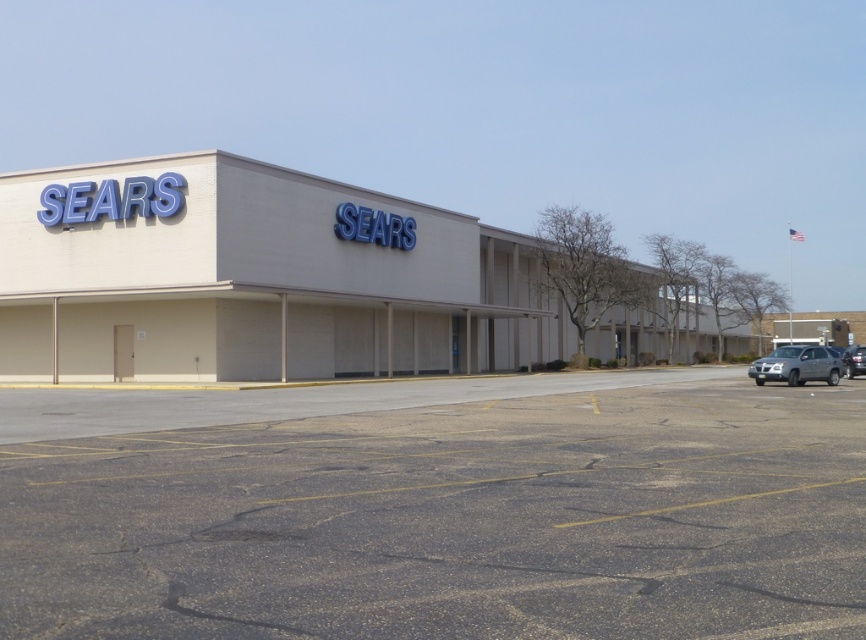
Based on the photo, between gray asphalt parking lot at lower center and beige/smooth building at center, which one is positioned lower?

gray asphalt parking lot at lower center is below.

Does gray asphalt parking lot at lower center appear over beige/smooth building at center?

No.

The image size is (866, 640). I want to click on gray asphalt parking lot at lower center, so click(x=453, y=522).

Image resolution: width=866 pixels, height=640 pixels. What are the coordinates of `gray asphalt parking lot at lower center` in the screenshot? It's located at (453, 522).

In the scene shown: Is gray asphalt parking lot at lower center above silver metallic suv at right?

No, gray asphalt parking lot at lower center is not above silver metallic suv at right.

Is gray asphalt parking lot at lower center smaller than silver metallic suv at right?

No, gray asphalt parking lot at lower center is not smaller than silver metallic suv at right.

Is point (456, 502) more distant than point (816, 376)?

No, (456, 502) is closer to viewer.

The image size is (866, 640). I want to click on gray asphalt parking lot at lower center, so coord(453,522).

Can you confirm if beige/smooth building at center is wider than silver metallic suv at right?

Yes, beige/smooth building at center is wider than silver metallic suv at right.

Does beige/smooth building at center have a lesser width compared to silver metallic suv at right?

No.

Which is behind, point (383, 349) or point (763, 356)?

The point (383, 349) is behind.

Where is `beige/smooth building at center`? The image size is (866, 640). beige/smooth building at center is located at coordinates (255, 278).